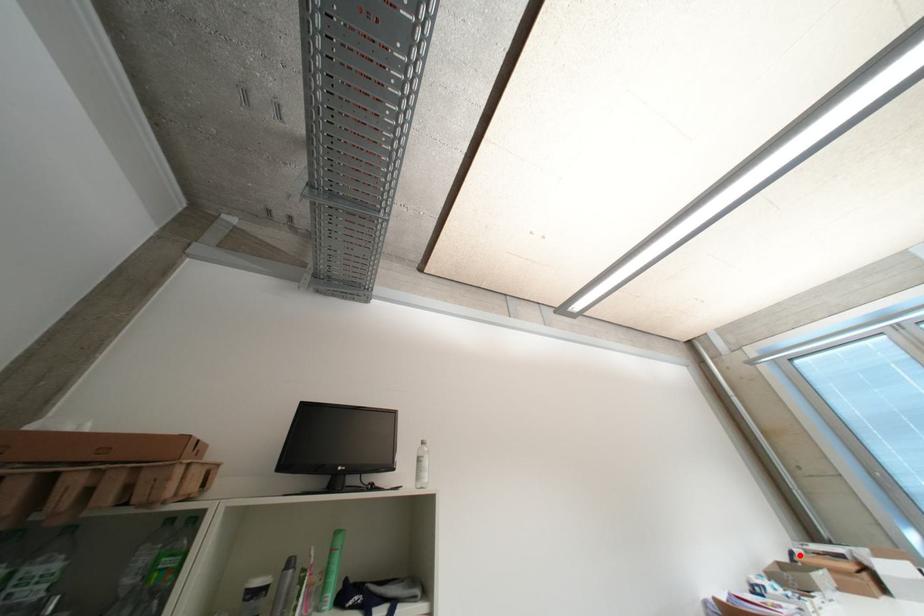
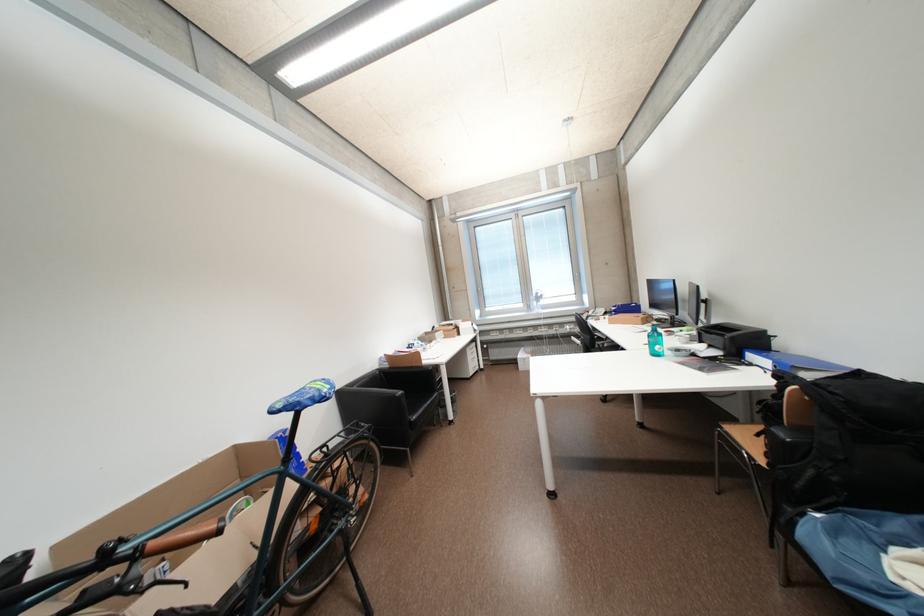
The point at the highlighted location is marked in the first image. Where is the corresponding point in the second image?

(442, 330)